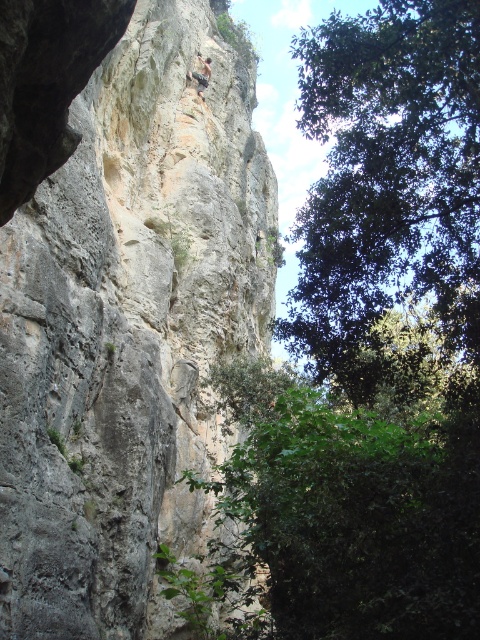
Question: Which of these objects is positioned closest to the rugged stone climber at upper center?

Choices:
 (A) green leafy tree at upper right
 (B) gray rough rock at center

Answer: (B)

Question: Which object appears closest to the camera in this image?

Choices:
 (A) rugged stone climber at upper center
 (B) green leafy tree at upper right

Answer: (B)

Question: Where is gray rough rock at center located in relation to green leafy tree at upper right in the image?

Choices:
 (A) above
 (B) below

Answer: (B)

Question: Is gray rough rock at center positioned at the back of rugged stone climber at upper center?

Choices:
 (A) yes
 (B) no

Answer: (B)

Question: Which object is positioned farthest from the gray rough rock at center?

Choices:
 (A) rugged stone climber at upper center
 (B) green leafy tree at upper right

Answer: (A)

Question: Observing the image, what is the correct spatial positioning of gray rough rock at center in reference to rugged stone climber at upper center?

Choices:
 (A) below
 (B) above

Answer: (A)